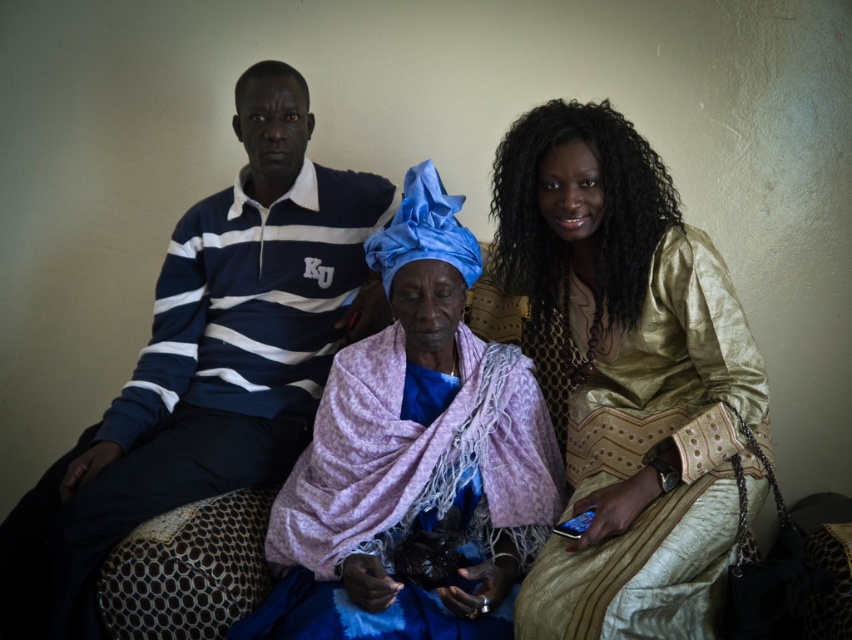
Measure the distance between point (639, 508) and camera.

Point (639, 508) and camera are 4.56 feet apart.

Which is above, gold metallic dress at center or purple fabric at center?

gold metallic dress at center is above.

Between point (606, 634) and point (424, 452), which one is positioned behind?

Point (424, 452)

Where is `gold metallic dress at center`? gold metallic dress at center is located at coordinates (629, 378).

Who is more forward, (223, 406) or (308, 628)?

Point (308, 628) is in front.

Does matte blue and white striped polo shirt at left appear over purple fabric at center?

Yes, matte blue and white striped polo shirt at left is above purple fabric at center.

Which is in front, point (205, 461) or point (459, 602)?

Point (459, 602)

The width and height of the screenshot is (852, 640). In order to click on matte blue and white striped polo shirt at left in this screenshot , I will do `click(209, 360)`.

Is point (671, 460) positioned behind point (177, 248)?

No, (671, 460) is closer to viewer.

Looking at this image, is the position of gold metallic dress at center more distant than that of matte blue and white striped polo shirt at left?

No, it is in front of matte blue and white striped polo shirt at left.

Between point (643, 164) and point (208, 448), which one is positioned in front?

Positioned in front is point (643, 164).

Image resolution: width=852 pixels, height=640 pixels. I want to click on gold metallic dress at center, so click(x=629, y=378).